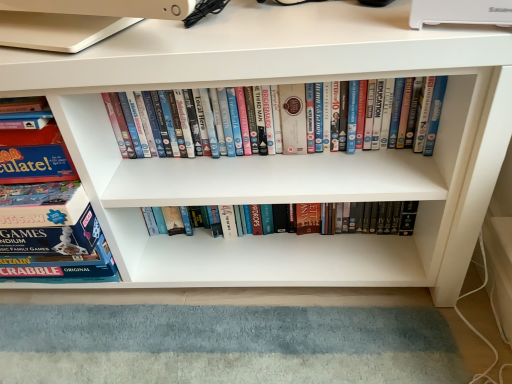
Image resolution: width=512 pixels, height=384 pixels. Describe the element at coordinates (47, 214) in the screenshot. I see `blue cardboard game box at left, which is the second book in right-to-left order` at that location.

Image resolution: width=512 pixels, height=384 pixels. I want to click on blue cardboard game box at left, which is the second book in right-to-left order, so click(47, 214).

What is the approximate height of blue cardboard game box at left, which is the second book in right-to-left order?

blue cardboard game box at left, which is the second book in right-to-left order, is 42.14 centimeters tall.

Measure the distance between blue cardboard game box at left, the first book from the left, and camera.

blue cardboard game box at left, the first book from the left, is 26.20 inches away from camera.

Where is `white glossy dvds at center, the 2th book positioned from the left`? white glossy dvds at center, the 2th book positioned from the left is located at coordinates (406, 108).

The height and width of the screenshot is (384, 512). What do you see at coordinates (406, 108) in the screenshot? I see `white glossy dvds at center, the 2th book positioned from the left` at bounding box center [406, 108].

At what (x,y) coordinates should I click in order to perform the action: click on blue cardboard game box at left, the first book from the left. Please return your answer as a coordinate pair (x, y). Looking at the image, I should click on (47, 214).

Considering the relative positions of blue cardboard game box at left, which is the second book in right-to-left order, and white glossy dvds at center, marked as the first book in a right-to-left arrangement, in the image provided, is blue cardboard game box at left, which is the second book in right-to-left order, to the left or to the right of white glossy dvds at center, marked as the first book in a right-to-left arrangement,?

Based on their positions, blue cardboard game box at left, which is the second book in right-to-left order, is located to the left of white glossy dvds at center, marked as the first book in a right-to-left arrangement.

Is blue cardboard game box at left, the first book from the left, in front of or behind white glossy dvds at center, the 2th book positioned from the left, in the image?

Clearly, blue cardboard game box at left, the first book from the left, is in front of white glossy dvds at center, the 2th book positioned from the left.

Is point (13, 265) farther from camera compared to point (398, 130)?

That is True.

Looking at this image, from the image's perspective, does blue cardboard game box at left, which is the second book in right-to-left order, appear higher than white glossy dvds at center, marked as the first book in a right-to-left arrangement?

No, from the image's perspective, blue cardboard game box at left, which is the second book in right-to-left order, is not above white glossy dvds at center, marked as the first book in a right-to-left arrangement.

From a real-world perspective, is blue cardboard game box at left, which is the second book in right-to-left order, located beneath white glossy dvds at center, marked as the first book in a right-to-left arrangement?

Yes, from a real-world perspective, blue cardboard game box at left, which is the second book in right-to-left order, is beneath white glossy dvds at center, marked as the first book in a right-to-left arrangement.

Looking at their sizes, would you say blue cardboard game box at left, the first book from the left, is wider or thinner than white glossy dvds at center, the 2th book positioned from the left?

blue cardboard game box at left, the first book from the left, is wider than white glossy dvds at center, the 2th book positioned from the left.

Between blue cardboard game box at left, which is the second book in right-to-left order, and white glossy dvds at center, the 2th book positioned from the left, which one has less height?

Standing shorter between the two is white glossy dvds at center, the 2th book positioned from the left.

Which of these two, blue cardboard game box at left, the first book from the left, or white glossy dvds at center, marked as the first book in a right-to-left arrangement, is bigger?

Bigger between the two is blue cardboard game box at left, the first book from the left.

Choose the correct answer: Is blue cardboard game box at left, the first book from the left, inside white glossy dvds at center, the 2th book positioned from the left, or outside it?

The correct answer is: outside.

In the scene shown: Are blue cardboard game box at left, the first book from the left, and white glossy dvds at center, marked as the first book in a right-to-left arrangement, located far from each other?

No, blue cardboard game box at left, the first book from the left, is in close proximity to white glossy dvds at center, marked as the first book in a right-to-left arrangement.

Is blue cardboard game box at left, which is the second book in right-to-left order, oriented away from white glossy dvds at center, marked as the first book in a right-to-left arrangement?

No.

Can you tell me how much blue cardboard game box at left, which is the second book in right-to-left order, and white glossy dvds at center, marked as the first book in a right-to-left arrangement, differ in facing direction?

They differ by 0.723 degrees in their facing directions.

Could you measure the distance between blue cardboard game box at left, the first book from the left, and white glossy dvds at center, marked as the first book in a right-to-left arrangement?

9.44 inches.

The image size is (512, 384). Identify the location of book above the blue cardboard game box at left, which is the second book in right-to-left order (from a real-world perspective). (406, 108).

Considering the relative positions of white glossy dvds at center, marked as the first book in a right-to-left arrangement, and blue cardboard game box at left, which is the second book in right-to-left order, in the image provided, is white glossy dvds at center, marked as the first book in a right-to-left arrangement, to the right of blue cardboard game box at left, which is the second book in right-to-left order, from the viewer's perspective?

Correct, you'll find white glossy dvds at center, marked as the first book in a right-to-left arrangement, to the right of blue cardboard game box at left, which is the second book in right-to-left order.

Which is behind, white glossy dvds at center, the 2th book positioned from the left, or blue cardboard game box at left, which is the second book in right-to-left order?

Positioned behind is white glossy dvds at center, the 2th book positioned from the left.

Does point (169, 99) come behind point (33, 154)?

That is True.

From the image's perspective, which one is positioned higher, white glossy dvds at center, the 2th book positioned from the left, or blue cardboard game box at left, which is the second book in right-to-left order?

white glossy dvds at center, the 2th book positioned from the left, from the image's perspective.

From a real-world perspective, which is physically below, white glossy dvds at center, the 2th book positioned from the left, or blue cardboard game box at left, the first book from the left?

blue cardboard game box at left, the first book from the left, is physically lower.

Can you confirm if white glossy dvds at center, marked as the first book in a right-to-left arrangement, is thinner than blue cardboard game box at left, which is the second book in right-to-left order?

Correct, the width of white glossy dvds at center, marked as the first book in a right-to-left arrangement, is less than that of blue cardboard game box at left, which is the second book in right-to-left order.

Which of these two, white glossy dvds at center, marked as the first book in a right-to-left arrangement, or blue cardboard game box at left, which is the second book in right-to-left order, stands taller?

With more height is blue cardboard game box at left, which is the second book in right-to-left order.

Based on their sizes in the image, would you say white glossy dvds at center, marked as the first book in a right-to-left arrangement, is bigger or smaller than blue cardboard game box at left, which is the second book in right-to-left order?

Clearly, white glossy dvds at center, marked as the first book in a right-to-left arrangement, is smaller in size than blue cardboard game box at left, which is the second book in right-to-left order.

Is white glossy dvds at center, marked as the first book in a right-to-left arrangement, not within blue cardboard game box at left, the first book from the left?

That's correct, white glossy dvds at center, marked as the first book in a right-to-left arrangement, is outside of blue cardboard game box at left, the first book from the left.

Based on the photo, is there a large distance between white glossy dvds at center, marked as the first book in a right-to-left arrangement, and blue cardboard game box at left, which is the second book in right-to-left order?

No, white glossy dvds at center, marked as the first book in a right-to-left arrangement, is not far from blue cardboard game box at left, which is the second book in right-to-left order.

Could you tell me if white glossy dvds at center, marked as the first book in a right-to-left arrangement, is turned towards blue cardboard game box at left, the first book from the left?

No, white glossy dvds at center, marked as the first book in a right-to-left arrangement, is not oriented towards blue cardboard game box at left, the first book from the left.

What's the angular difference between white glossy dvds at center, the 2th book positioned from the left, and blue cardboard game box at left, the first book from the left,'s facing directions?

The angle between the facing direction of white glossy dvds at center, the 2th book positioned from the left, and the facing direction of blue cardboard game box at left, the first book from the left, is 0.723 degrees.

Identify the location of book above the blue cardboard game box at left, which is the second book in right-to-left order (from the image's perspective). The width and height of the screenshot is (512, 384). (406, 108).

Identify the location of book behind the blue cardboard game box at left, which is the second book in right-to-left order. (406, 108).

At what (x,y) coordinates should I click in order to perform the action: click on book located below the white glossy dvds at center, marked as the first book in a right-to-left arrangement (from the image's perspective). Please return your answer as a coordinate pair (x, y). Looking at the image, I should click on (47, 214).